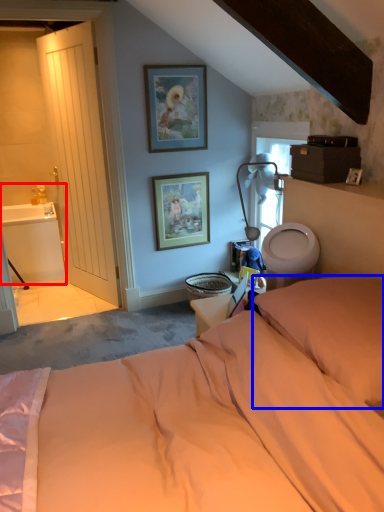
Question: Which point is closer to the camera, sink (highlighted by a red box) or pillow (highlighted by a blue box)?

Choices:
 (A) sink
 (B) pillow

Answer: (B)